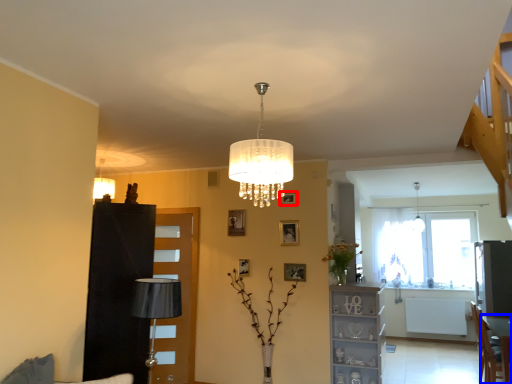
Question: Which point is closer to the camera, picture frame (highlighted by a red box) or table (highlighted by a blue box)?

Choices:
 (A) picture frame
 (B) table

Answer: (B)